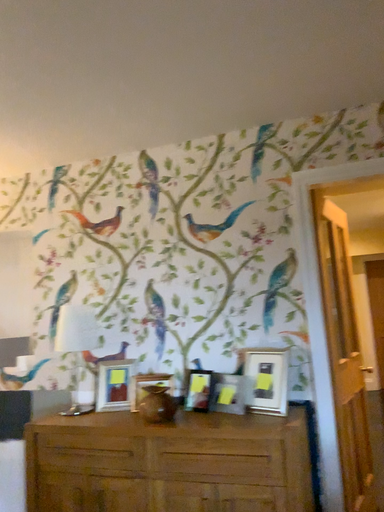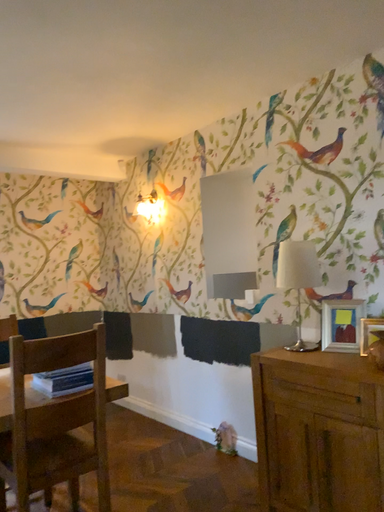
Question: Which way did the camera rotate in the video?

Choices:
 (A) rotated upward
 (B) rotated downward

Answer: (B)